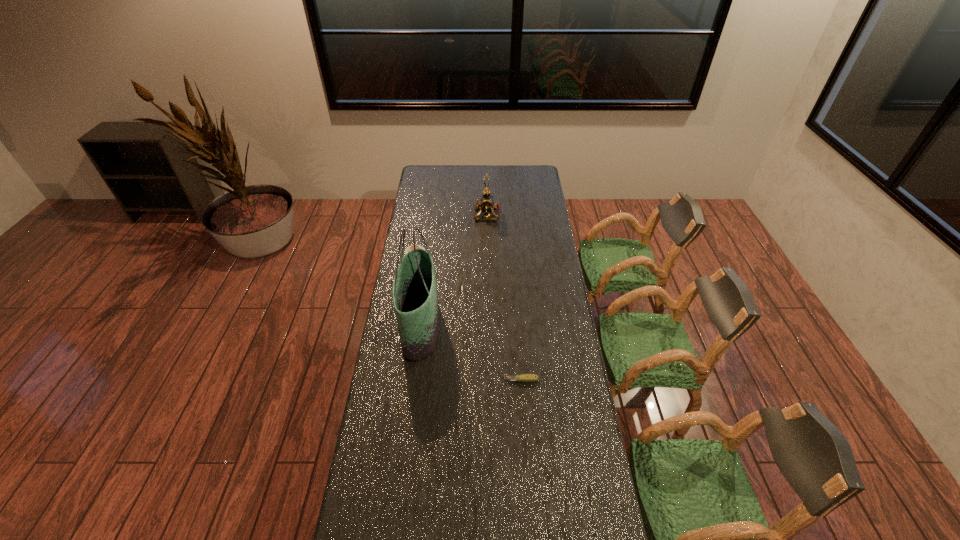
Image resolution: width=960 pixels, height=540 pixels. What are the coordinates of `the third farthest object` in the screenshot? It's located at (415, 295).

This screenshot has height=540, width=960. I want to click on tote bag, so click(x=415, y=295).

Locate an element on the screen. This screenshot has height=540, width=960. telephone is located at coordinates (486, 204).

What are the coordinates of `the second tallest object` in the screenshot? It's located at (486, 204).

Image resolution: width=960 pixels, height=540 pixels. Find the location of `pudding`. pudding is located at coordinates (409, 248).

The height and width of the screenshot is (540, 960). I want to click on the second shortest object, so click(x=409, y=248).

Locate an element on the screen. The height and width of the screenshot is (540, 960). the shortest object is located at coordinates (525, 378).

Where is `the nearest object`? This screenshot has width=960, height=540. the nearest object is located at coordinates (525, 378).

Image resolution: width=960 pixels, height=540 pixels. What are the coordinates of `vacant space located on the back of the third farthest object` in the screenshot? It's located at (429, 262).

Locate an element on the screen. This screenshot has width=960, height=540. free space located 0.220m on the front of the telephone, featuring the rotary dial is located at coordinates (434, 214).